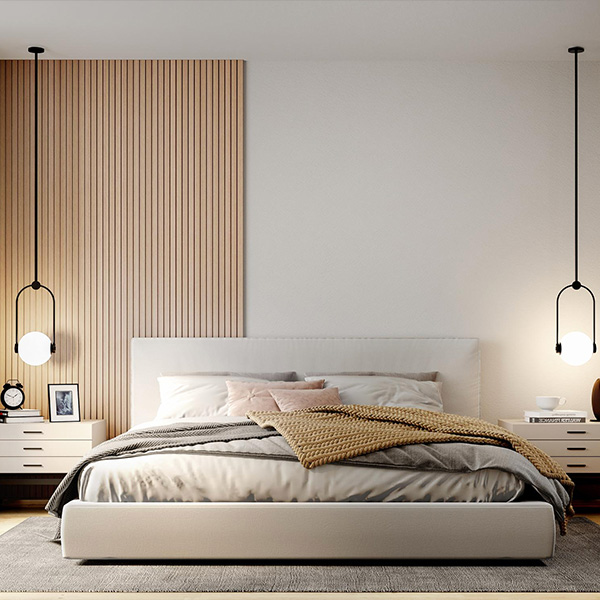
Find the location of a particular element. The width and height of the screenshot is (600, 600). paneling is located at coordinates (144, 260).